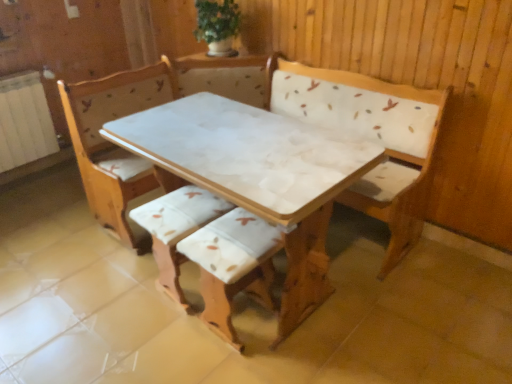
Question: Which direction should I rotate to look at wooden armchair at center, which is the first armchair in right-to-left order?

Choices:
 (A) right
 (B) left

Answer: (B)

Question: Considering the relative sizes of white marble table at center and green leafy plant at upper center in the image provided, is white marble table at center shorter than green leafy plant at upper center?

Choices:
 (A) no
 (B) yes

Answer: (A)

Question: Is white marble table at center not close to green leafy plant at upper center?

Choices:
 (A) yes
 (B) no

Answer: (A)

Question: Is white marble table at center bigger than green leafy plant at upper center?

Choices:
 (A) no
 (B) yes

Answer: (B)

Question: Is the position of white marble table at center less distant than that of green leafy plant at upper center?

Choices:
 (A) no
 (B) yes

Answer: (B)

Question: From the image's perspective, would you say white marble table at center is positioned over green leafy plant at upper center?

Choices:
 (A) yes
 (B) no

Answer: (B)

Question: Does white marble table at center come behind green leafy plant at upper center?

Choices:
 (A) yes
 (B) no

Answer: (B)

Question: Can you confirm if white fabric cushion at center, which is the 2th armchair from right to left, is shorter than wooden armchair at center, which is the first armchair in right-to-left order?

Choices:
 (A) yes
 (B) no

Answer: (A)

Question: Is white fabric cushion at center, which is the 2th armchair from right to left, thinner than wooden armchair at center, marked as the second armchair in a left-to-right arrangement?

Choices:
 (A) yes
 (B) no

Answer: (A)

Question: From the image's perspective, would you say white fabric cushion at center, which is the first armchair in left-to-right order, is shown under wooden armchair at center, which is the first armchair in right-to-left order?

Choices:
 (A) no
 (B) yes

Answer: (A)

Question: Is white fabric cushion at center, which is the first armchair in left-to-right order, further to camera compared to wooden armchair at center, marked as the second armchair in a left-to-right arrangement?

Choices:
 (A) no
 (B) yes

Answer: (B)

Question: Is wooden armchair at center, marked as the second armchair in a left-to-right arrangement, at the back of white fabric cushion at center, which is the 2th armchair from right to left?

Choices:
 (A) no
 (B) yes

Answer: (A)

Question: Would you say white fabric cushion at center, which is the first armchair in left-to-right order, is outside wooden armchair at center, marked as the second armchair in a left-to-right arrangement?

Choices:
 (A) yes
 (B) no

Answer: (A)

Question: Does white marble table at center appear on the right side of white fabric cushion at center, which is the 2th armchair from right to left?

Choices:
 (A) no
 (B) yes

Answer: (B)